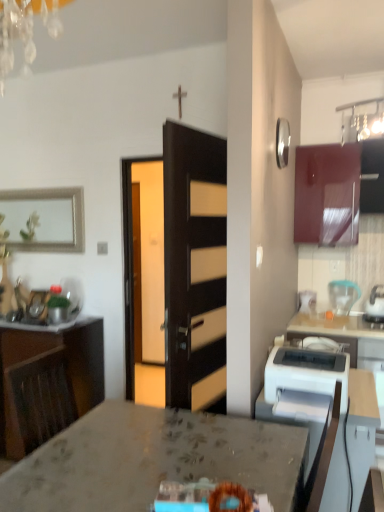
Question: Is glossy wood cabinet at upper right, acting as the 2th cabinetry starting from the bottom, thinner than marble countertop at center?

Choices:
 (A) yes
 (B) no

Answer: (A)

Question: Can you confirm if glossy wood cabinet at upper right, acting as the 2th cabinetry starting from the bottom, is bigger than marble countertop at center?

Choices:
 (A) yes
 (B) no

Answer: (B)

Question: From a real-world perspective, does glossy wood cabinet at upper right, acting as the 2th cabinetry starting from the bottom, sit lower than marble countertop at center?

Choices:
 (A) yes
 (B) no

Answer: (B)

Question: Is glossy wood cabinet at upper right, which is the second cabinetry from left to right, smaller than marble countertop at center?

Choices:
 (A) yes
 (B) no

Answer: (A)

Question: Is glossy wood cabinet at upper right, acting as the 2th cabinetry starting from the bottom, not within marble countertop at center?

Choices:
 (A) no
 (B) yes

Answer: (B)

Question: Considering the relative sizes of glossy wood cabinet at upper right, which is the first cabinetry in top-to-bottom order, and marble countertop at center in the image provided, is glossy wood cabinet at upper right, which is the first cabinetry in top-to-bottom order, wider than marble countertop at center?

Choices:
 (A) yes
 (B) no

Answer: (B)

Question: Is white glossy kettle at upper right, the second kitchen appliance from the back, wider than translucent plastic blender at right, marked as the 1th kitchen appliance in a back-to-front arrangement?

Choices:
 (A) no
 (B) yes

Answer: (B)

Question: Is white glossy kettle at upper right, the second kitchen appliance from the back, oriented away from translucent plastic blender at right, marked as the 1th kitchen appliance in a back-to-front arrangement?

Choices:
 (A) no
 (B) yes

Answer: (A)

Question: Is white glossy kettle at upper right, the second kitchen appliance from the back, to the left of translucent plastic blender at right, marked as the second kitchen appliance in a front-to-back arrangement, from the viewer's perspective?

Choices:
 (A) yes
 (B) no

Answer: (B)

Question: Is white glossy kettle at upper right, the second kitchen appliance from the back, shorter than translucent plastic blender at right, marked as the second kitchen appliance in a front-to-back arrangement?

Choices:
 (A) yes
 (B) no

Answer: (B)

Question: Is white glossy kettle at upper right, acting as the first kitchen appliance starting from the front, not close to translucent plastic blender at right, marked as the second kitchen appliance in a front-to-back arrangement?

Choices:
 (A) no
 (B) yes

Answer: (A)

Question: Is white glossy kettle at upper right, acting as the first kitchen appliance starting from the front, not inside translucent plastic blender at right, marked as the second kitchen appliance in a front-to-back arrangement?

Choices:
 (A) no
 (B) yes

Answer: (B)

Question: Does white glossy table at lower right come behind wooden cabinet at left, placed as the second cabinetry when sorted from right to left?

Choices:
 (A) no
 (B) yes

Answer: (A)